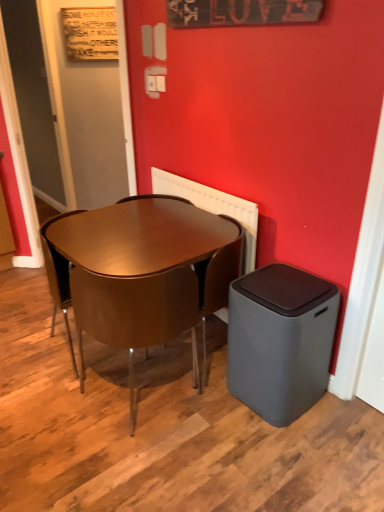
Question: From the image's perspective, does wooden signboard at upper center, the first bulletin board viewed from the right, appear lower than brown leather chair at center, which is the 2th chair in left-to-right order?

Choices:
 (A) no
 (B) yes

Answer: (A)

Question: Is brown leather chair at center, marked as the 2th chair in a right-to-left arrangement, located within wooden signboard at upper center, which ranks as the 2th bulletin board in back-to-front order?

Choices:
 (A) yes
 (B) no

Answer: (B)

Question: From a real-world perspective, is wooden signboard at upper center, the first bulletin board viewed from the right, under brown leather chair at center, marked as the 2th chair in a right-to-left arrangement?

Choices:
 (A) yes
 (B) no

Answer: (B)

Question: Considering the relative sizes of wooden signboard at upper center, the 2th bulletin board from the top, and brown leather chair at center, marked as the 2th chair in a right-to-left arrangement, in the image provided, is wooden signboard at upper center, the 2th bulletin board from the top, shorter than brown leather chair at center, marked as the 2th chair in a right-to-left arrangement,?

Choices:
 (A) yes
 (B) no

Answer: (A)

Question: Is wooden signboard at upper center, the 2th bulletin board from the top, positioned far away from brown leather chair at center, which is the 2th chair in left-to-right order?

Choices:
 (A) no
 (B) yes

Answer: (B)

Question: Is wooden signboard at upper center, the 1th bulletin board when ordered from bottom to top, outside of brown leather chair at center, which is the 2th chair in left-to-right order?

Choices:
 (A) yes
 (B) no

Answer: (A)

Question: Is brown glossy chair at center, acting as the 1th chair starting from the right, taller than wooden signboard at upper left, acting as the 2th bulletin board starting from the right?

Choices:
 (A) no
 (B) yes

Answer: (B)

Question: Can you confirm if brown glossy chair at center, acting as the 1th chair starting from the right, is wider than wooden signboard at upper left, the second bulletin board when ordered from front to back?

Choices:
 (A) yes
 (B) no

Answer: (A)

Question: Does brown glossy chair at center, acting as the 1th chair starting from the right, lie behind wooden signboard at upper left, positioned as the 1th bulletin board in left-to-right order?

Choices:
 (A) no
 (B) yes

Answer: (A)

Question: Considering the relative sizes of brown glossy chair at center, which is counted as the third chair, starting from the left, and wooden signboard at upper left, arranged as the 2th bulletin board when ordered from the bottom, in the image provided, is brown glossy chair at center, which is counted as the third chair, starting from the left, bigger than wooden signboard at upper left, arranged as the 2th bulletin board when ordered from the bottom,?

Choices:
 (A) no
 (B) yes

Answer: (B)

Question: Is wooden signboard at upper left, the second bulletin board when ordered from front to back, at the back of brown glossy chair at center, which is counted as the third chair, starting from the left?

Choices:
 (A) yes
 (B) no

Answer: (B)

Question: Is wooden signboard at upper left, marked as the 1th bulletin board in a top-to-bottom arrangement, completely or partially inside brown glossy chair at center, which is counted as the third chair, starting from the left?

Choices:
 (A) no
 (B) yes

Answer: (A)

Question: Can you confirm if gray matte trash bin at lower right is taller than matte gray door at upper left, placed as the first door when sorted from left to right?

Choices:
 (A) yes
 (B) no

Answer: (B)